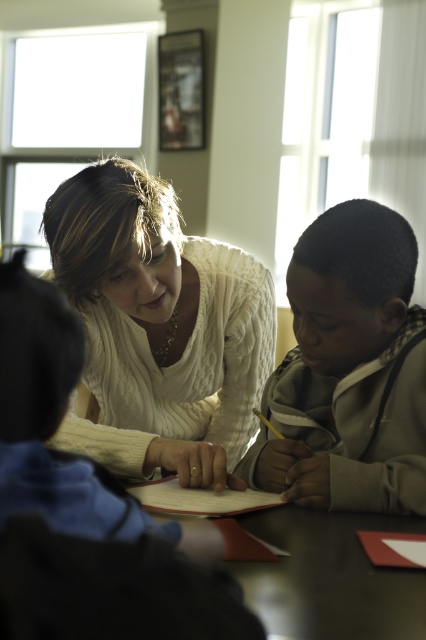
You are standing at the table and want to reach both the point at coordinates point (339,352) and the point at coordinates point (282,509). Which point should you reach for first if you want to touch them in order from closest to farthest?

You should reach for point (282,509) first because it is closer to you than point (339,352), which is behind it.